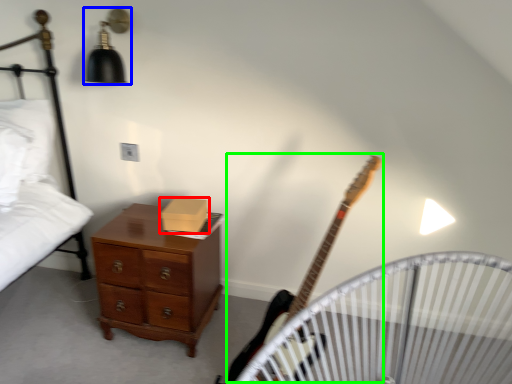
Question: Considering the real-world distances, which object is closest to box (highlighted by a red box)? light fixture (highlighted by a blue box) or guitar (highlighted by a green box).

Choices:
 (A) light fixture
 (B) guitar

Answer: (B)